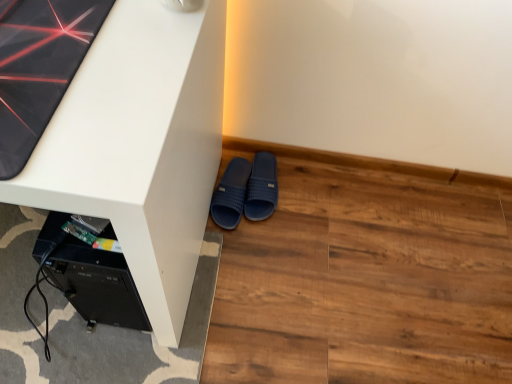
Question: Can you confirm if dark blue rubber slippers at lower center, which ranks as the first footwear in left-to-right order, is wider than white matte desk at center?

Choices:
 (A) no
 (B) yes

Answer: (A)

Question: From the image's perspective, is dark blue rubber slippers at lower center, which is counted as the 2th footwear, starting from the right, on top of white matte desk at center?

Choices:
 (A) yes
 (B) no

Answer: (B)

Question: Considering the relative positions of dark blue rubber slippers at lower center, which ranks as the first footwear in left-to-right order, and white matte desk at center in the image provided, is dark blue rubber slippers at lower center, which ranks as the first footwear in left-to-right order, to the left of white matte desk at center from the viewer's perspective?

Choices:
 (A) no
 (B) yes

Answer: (A)

Question: Is dark blue rubber slippers at lower center, which ranks as the first footwear in left-to-right order, smaller than white matte desk at center?

Choices:
 (A) yes
 (B) no

Answer: (A)

Question: From a real-world perspective, is dark blue rubber slippers at lower center, which ranks as the first footwear in left-to-right order, physically below white matte desk at center?

Choices:
 (A) no
 (B) yes

Answer: (B)

Question: Is dark blue rubber slippers at lower center, which is counted as the 2th footwear, starting from the right, facing away from white matte desk at center?

Choices:
 (A) no
 (B) yes

Answer: (A)

Question: Does dark blue rubber slippers at lower center, which ranks as the first footwear in left-to-right order, have a greater width compared to brown wood flooring at lower right?

Choices:
 (A) no
 (B) yes

Answer: (A)

Question: Are dark blue rubber slippers at lower center, which ranks as the first footwear in left-to-right order, and brown wood flooring at lower right beside each other?

Choices:
 (A) no
 (B) yes

Answer: (A)

Question: From a real-world perspective, is dark blue rubber slippers at lower center, which is counted as the 2th footwear, starting from the right, physically below brown wood flooring at lower right?

Choices:
 (A) yes
 (B) no

Answer: (B)

Question: Is dark blue rubber slippers at lower center, which is counted as the 2th footwear, starting from the right, positioned with its back to brown wood flooring at lower right?

Choices:
 (A) yes
 (B) no

Answer: (B)

Question: Does dark blue rubber slippers at lower center, which is counted as the 2th footwear, starting from the right, have a smaller size compared to brown wood flooring at lower right?

Choices:
 (A) yes
 (B) no

Answer: (A)

Question: Does dark blue rubber slippers at lower center, which ranks as the first footwear in left-to-right order, lie behind brown wood flooring at lower right?

Choices:
 (A) yes
 (B) no

Answer: (A)

Question: From a real-world perspective, is navy blue rubber slippers at lower center, the 2th footwear viewed from the left, positioned under white matte desk at center based on gravity?

Choices:
 (A) yes
 (B) no

Answer: (A)